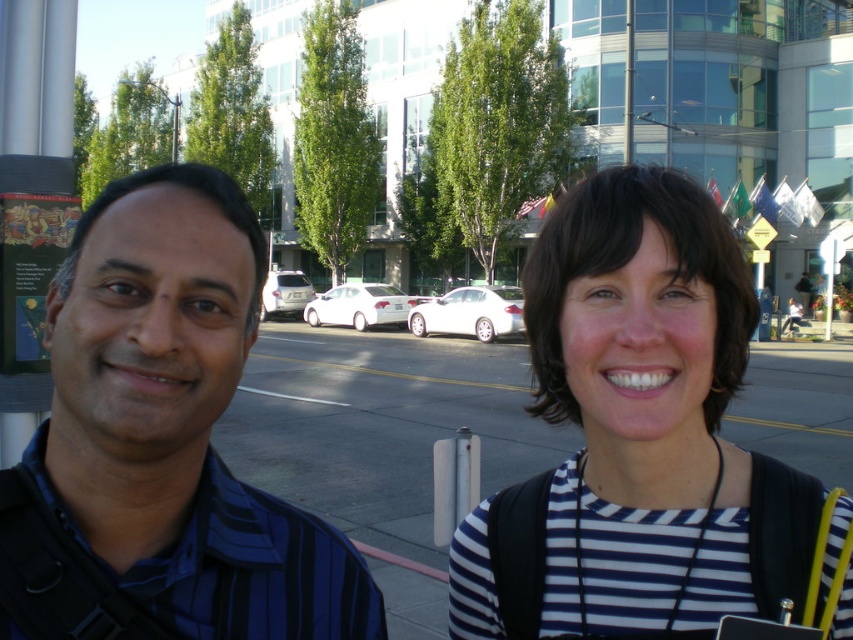
Question: Can you confirm if white striped shirt at center is positioned below blue striped shirt at left?

Choices:
 (A) no
 (B) yes

Answer: (B)

Question: Which point is closer to the camera?

Choices:
 (A) blue striped shirt at left
 (B) white striped shirt at center

Answer: (A)

Question: Does white striped shirt at center come in front of blue striped shirt at left?

Choices:
 (A) no
 (B) yes

Answer: (A)

Question: Which of the following is the closest to the observer?

Choices:
 (A) click(x=170, y=509)
 (B) click(x=619, y=228)

Answer: (A)

Question: Does white striped shirt at center appear under blue striped shirt at left?

Choices:
 (A) yes
 (B) no

Answer: (A)